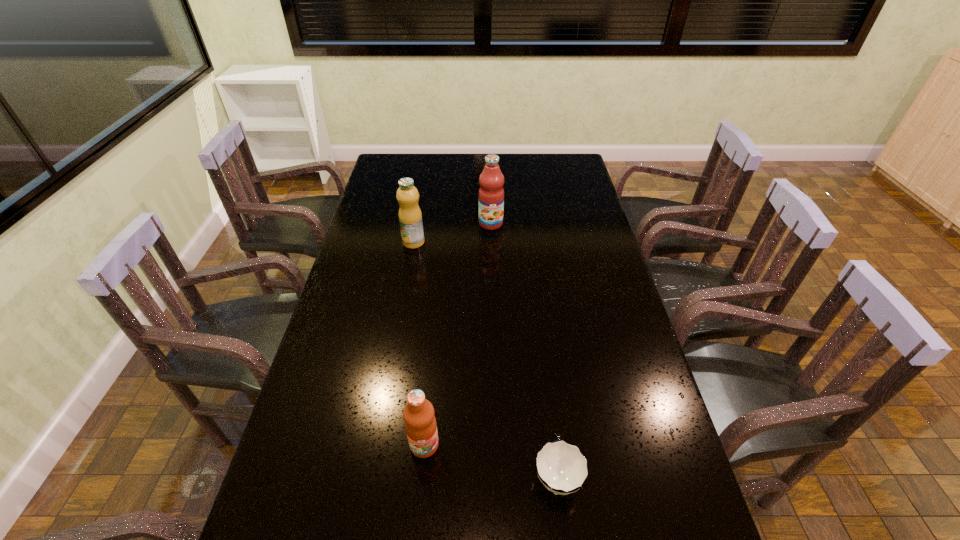
Where is `the rightmost fruit juice`? the rightmost fruit juice is located at coordinates (491, 193).

Where is `the second object from right to left`? Image resolution: width=960 pixels, height=540 pixels. the second object from right to left is located at coordinates (491, 193).

Find the location of `the leftmost fruit juice`. the leftmost fruit juice is located at coordinates pos(410,217).

Locate an element on the screen. This screenshot has width=960, height=540. the leftmost object is located at coordinates (410, 217).

Where is `the third tallest object`? The height and width of the screenshot is (540, 960). the third tallest object is located at coordinates (420, 423).

Where is `the second fruit juice from right to left`? The height and width of the screenshot is (540, 960). the second fruit juice from right to left is located at coordinates (420, 423).

In order to click on the shortest object in this screenshot , I will do `click(561, 467)`.

You are a GUI agent. You are given a task and a screenshot of the screen. Output one action in this format:
    pyautogui.click(x=<x>, y=<y>)
    Task: Click on the cup
    
    Given the screenshot: What is the action you would take?
    pyautogui.click(x=561, y=467)

This screenshot has width=960, height=540. Identify the location of vacant space situated 0.110m on the front label of the farthest fruit juice. (492, 249).

Where is `vacant region located 0.310m on the front label of the second farthest fruit juice`? vacant region located 0.310m on the front label of the second farthest fruit juice is located at coordinates (401, 313).